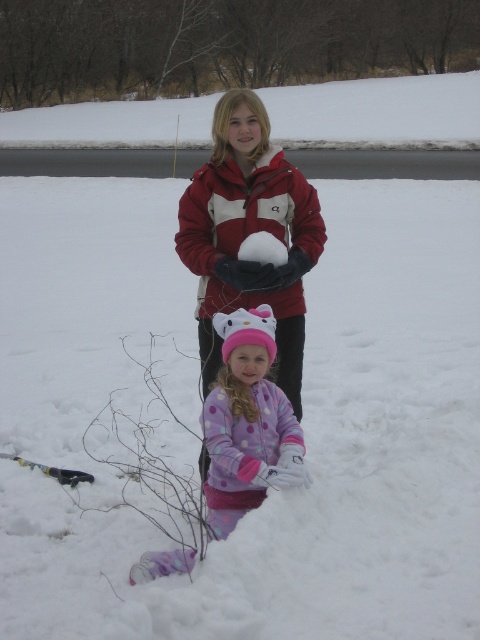
Is matte red jacket at center positioned before purple polka dot snowsuit at center?

No, it is not.

Is point (311, 228) less distant than point (241, 368)?

No, (311, 228) is further to viewer.

The width and height of the screenshot is (480, 640). In order to click on matte red jacket at center in this screenshot , I will do `click(248, 234)`.

What do you see at coordinates (248, 234) in the screenshot? This screenshot has width=480, height=640. I see `matte red jacket at center` at bounding box center [248, 234].

Can you confirm if matte red jacket at center is shorter than white fluffy snowball at center?

No.

Image resolution: width=480 pixels, height=640 pixels. I want to click on matte red jacket at center, so click(248, 234).

Is point (315, 211) less distant than point (7, 456)?

Yes.

From the picture: Is matte red jacket at center smaller than yellow and black ski at lower left?

Actually, matte red jacket at center might be larger than yellow and black ski at lower left.

Locate an element on the screen. This screenshot has width=480, height=640. matte red jacket at center is located at coordinates (248, 234).

Find the location of a particular element. The image size is (480, 640). matte red jacket at center is located at coordinates (248, 234).